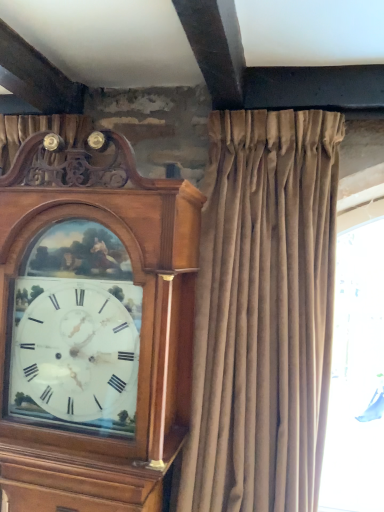
Describe the element at coordinates (263, 313) in the screenshot. I see `velvet beige curtain at center` at that location.

The image size is (384, 512). Find the location of `velvet beige curtain at center`. velvet beige curtain at center is located at coordinates (263, 313).

What is the approximate width of wooden grandfather clock at left?

wooden grandfather clock at left is 33.91 centimeters in width.

Locate an element on the screen. This screenshot has height=512, width=384. wooden grandfather clock at left is located at coordinates (98, 331).

What do you see at coordinates (98, 331) in the screenshot? I see `wooden grandfather clock at left` at bounding box center [98, 331].

In order to face wooden grandfather clock at left, should I rotate leftwards or rightwards?

To face it directly, rotate left by 13.313 degrees.

At what (x,y) coordinates should I click in order to perform the action: click on velvet beige curtain at center. Please return your answer as a coordinate pair (x, y). Looking at the image, I should click on (263, 313).

Considering the relative positions of velvet beige curtain at center and wooden grandfather clock at left in the image provided, is velvet beige curtain at center to the right of wooden grandfather clock at left from the viewer's perspective?

Yes, velvet beige curtain at center is to the right of wooden grandfather clock at left.

Does velvet beige curtain at center come behind wooden grandfather clock at left?

No.

Is point (278, 181) positioned before point (49, 350)?

That is False.

From the image's perspective, is velvet beige curtain at center on wooden grandfather clock at left?

Yes.

Based on the photo, from a real-world perspective, which object rests below the other?

In real-world perspective, wooden grandfather clock at left is lower.

Considering the relative sizes of velvet beige curtain at center and wooden grandfather clock at left in the image provided, is velvet beige curtain at center thinner than wooden grandfather clock at left?

In fact, velvet beige curtain at center might be wider than wooden grandfather clock at left.

Considering the sizes of objects velvet beige curtain at center and wooden grandfather clock at left in the image provided, who is shorter, velvet beige curtain at center or wooden grandfather clock at left?

wooden grandfather clock at left.

Is velvet beige curtain at center bigger than wooden grandfather clock at left?

Correct, velvet beige curtain at center is larger in size than wooden grandfather clock at left.

Is velvet beige curtain at center not within wooden grandfather clock at left?

Yes, velvet beige curtain at center is not within wooden grandfather clock at left.

Is velvet beige curtain at center placed right next to wooden grandfather clock at left?

velvet beige curtain at center is not next to wooden grandfather clock at left, and they're not touching.

Is velvet beige curtain at center oriented towards wooden grandfather clock at left?

No, velvet beige curtain at center is not oriented towards wooden grandfather clock at left.

The height and width of the screenshot is (512, 384). What are the coordinates of `curtain located above the wooden grandfather clock at left (from the image's perspective)` in the screenshot? It's located at (263, 313).

Which object is positioned more to the left, wooden grandfather clock at left or velvet beige curtain at center?

wooden grandfather clock at left.

Who is more distant, wooden grandfather clock at left or velvet beige curtain at center?

wooden grandfather clock at left is further from the camera.

Is point (142, 459) behind point (286, 193)?

No.

From the image's perspective, which one is positioned lower, wooden grandfather clock at left or velvet beige curtain at center?

wooden grandfather clock at left appears lower in the image.

From a real-world perspective, is wooden grandfather clock at left on velvet beige curtain at center?

No, from a real-world perspective, wooden grandfather clock at left is not on top of velvet beige curtain at center.

Between wooden grandfather clock at left and velvet beige curtain at center, which one has smaller width?

wooden grandfather clock at left.

Who is shorter, wooden grandfather clock at left or velvet beige curtain at center?

With less height is wooden grandfather clock at left.

Based on their sizes in the image, would you say wooden grandfather clock at left is bigger or smaller than velvet beige curtain at center?

Clearly, wooden grandfather clock at left is smaller in size than velvet beige curtain at center.

Looking at this image, is wooden grandfather clock at left outside of velvet beige curtain at center?

Absolutely, wooden grandfather clock at left is external to velvet beige curtain at center.

Are wooden grandfather clock at left and velvet beige curtain at center located far from each other?

No.

Could you tell me if wooden grandfather clock at left is turned towards velvet beige curtain at center?

No, wooden grandfather clock at left is not oriented towards velvet beige curtain at center.

How much distance is there between wooden grandfather clock at left and velvet beige curtain at center?

wooden grandfather clock at left and velvet beige curtain at center are 10.26 inches apart.

Where is `curtain that is on the right side of wooden grandfather clock at left`? curtain that is on the right side of wooden grandfather clock at left is located at coordinates (263, 313).

Where is `curtain above the wooden grandfather clock at left (from the image's perspective)`? curtain above the wooden grandfather clock at left (from the image's perspective) is located at coordinates (263, 313).

What are the coordinates of `curtain located above the wooden grandfather clock at left (from a real-world perspective)` in the screenshot? It's located at (263, 313).